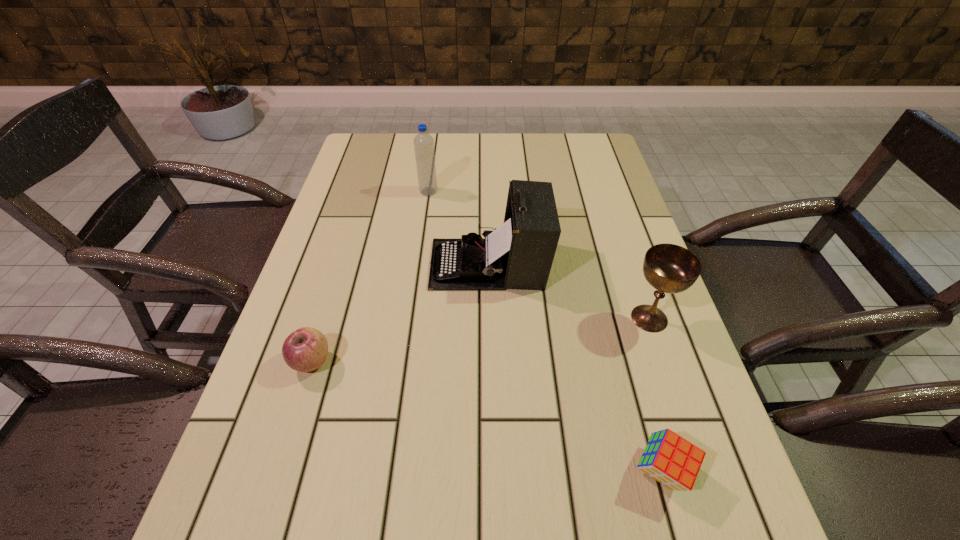
This screenshot has height=540, width=960. Identify the location of free space located 0.260m inside the open case of the second farthest object. (323, 264).

Identify the location of vacant space situated 0.260m on the left of the chalice. (506, 318).

The image size is (960, 540). In order to click on free region located on the right of the leftmost object in this screenshot , I will do `click(432, 362)`.

This screenshot has height=540, width=960. Find the location of `blank space located on the back of the nearest object`. blank space located on the back of the nearest object is located at coordinates (627, 346).

The height and width of the screenshot is (540, 960). Identify the location of object located in the left edge section of the desktop. (306, 349).

Locate an element on the screen. This screenshot has width=960, height=540. chalice at the right edge is located at coordinates (669, 268).

Where is `cube that is positioned at the right edge`? The height and width of the screenshot is (540, 960). cube that is positioned at the right edge is located at coordinates (668, 458).

The width and height of the screenshot is (960, 540). I want to click on free spot at the far edge of the desktop, so click(533, 165).

Image resolution: width=960 pixels, height=540 pixels. In the image, there is a desktop. Identify the location of vacant space at the left edge. (324, 222).

At what (x,y) coordinates should I click in order to perform the action: click on vacant position at the right edge of the desktop. Please return your answer as a coordinate pair (x, y). Looking at the image, I should click on (690, 491).